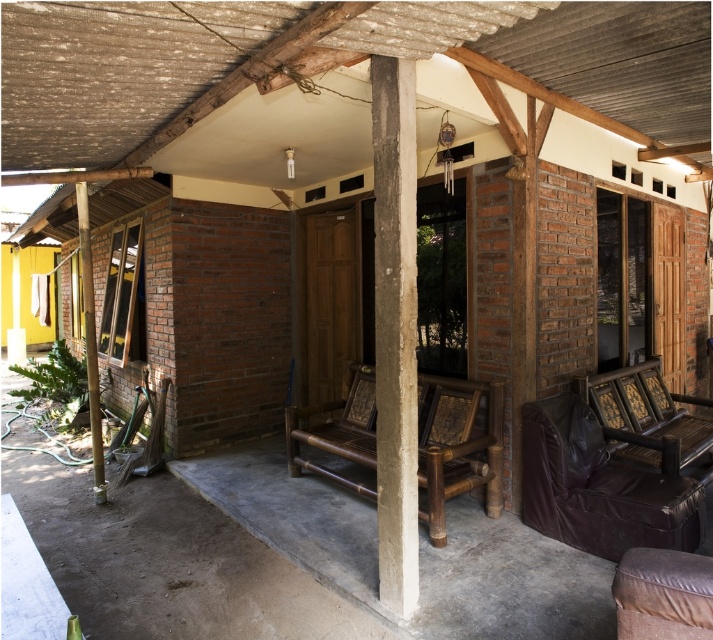
You are standing on the porch and want to sit down. There is a concrete at center and a brown wooden bench at center. Which one is closer to you so you can sit?

The concrete at center is closer to the viewer than the brown wooden bench at center, so you should sit on the concrete at center.